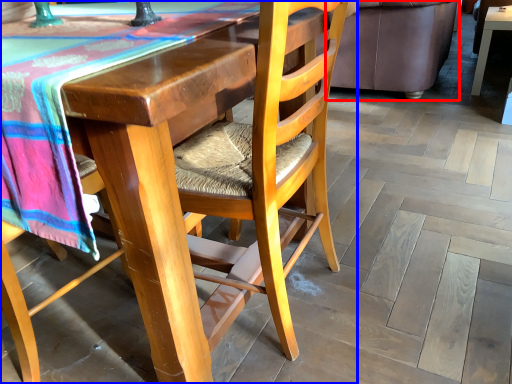
Question: Which point is closer to the camera, couch (highlighted by a red box) or chair (highlighted by a blue box)?

Choices:
 (A) couch
 (B) chair

Answer: (B)